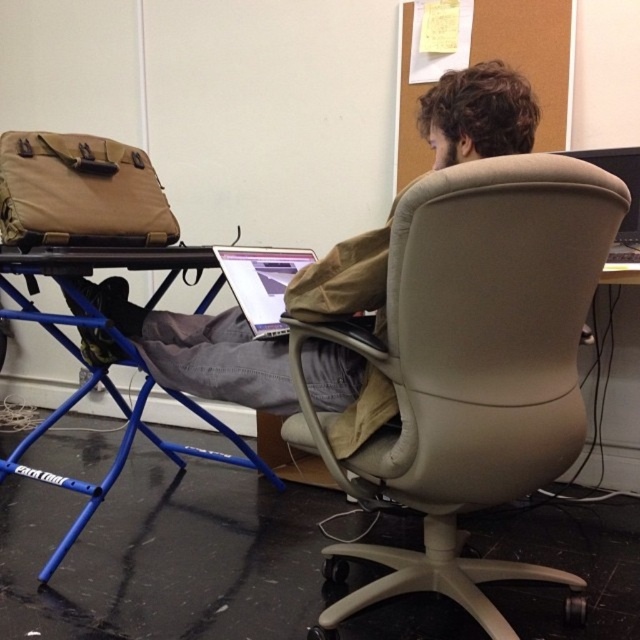
Who is more distant from viewer, (x=476, y=497) or (x=134, y=324)?

The point (x=134, y=324) is more distant.

Does beige fabric office chair at center have a greater width compared to matte khaki jacket at center?

No, beige fabric office chair at center is not wider than matte khaki jacket at center.

The width and height of the screenshot is (640, 640). What do you see at coordinates (472, 369) in the screenshot?
I see `beige fabric office chair at center` at bounding box center [472, 369].

Find the location of `beige fabric office chair at center`. beige fabric office chair at center is located at coordinates (472, 369).